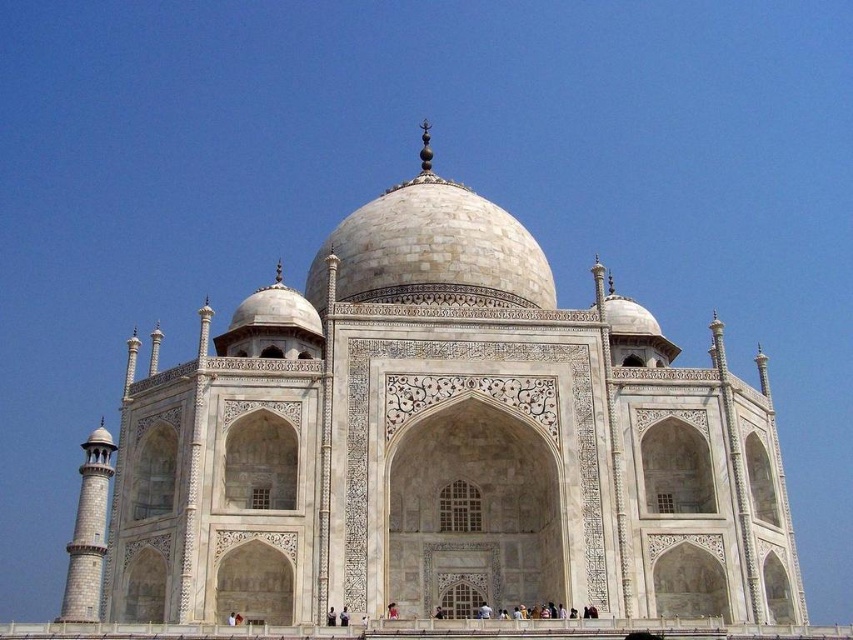
Question: Can you confirm if red fabric person at center is wider than smooth white person at center?

Choices:
 (A) no
 (B) yes

Answer: (B)

Question: Where is white marble taj mahal at center located in relation to red fabric person at center in the image?

Choices:
 (A) left
 (B) right

Answer: (A)

Question: Which object appears closest to the camera in this image?

Choices:
 (A) red fabric person at center
 (B) white marble taj mahal at center

Answer: (B)

Question: Does red fabric person at center appear over smooth white person at center?

Choices:
 (A) yes
 (B) no

Answer: (B)

Question: Which of the following is the closest to the observer?

Choices:
 (A) (343, 612)
 (B) (387, 605)

Answer: (A)

Question: Which point is closer to the camera taking this photo?

Choices:
 (A) (393, 612)
 (B) (438, 566)
 (C) (344, 624)

Answer: (C)